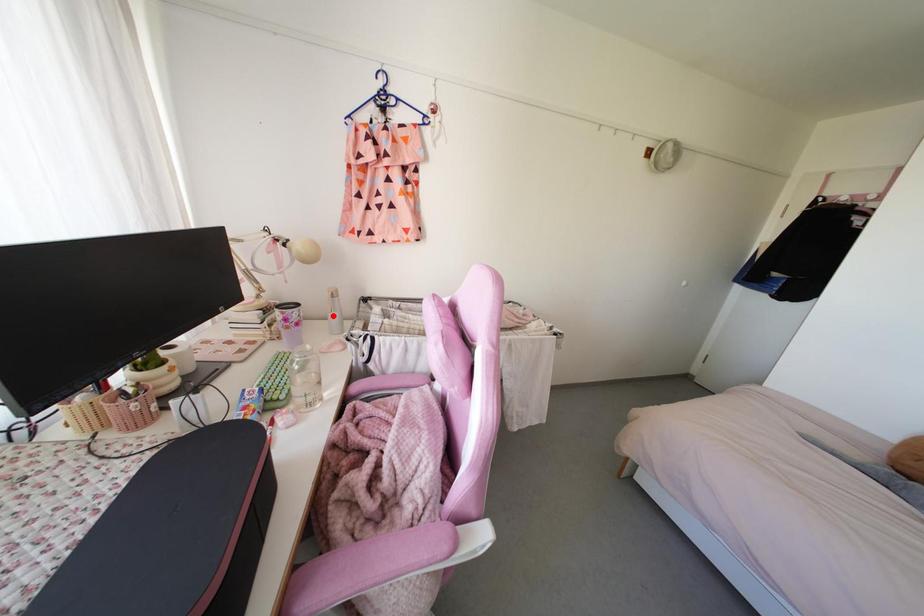
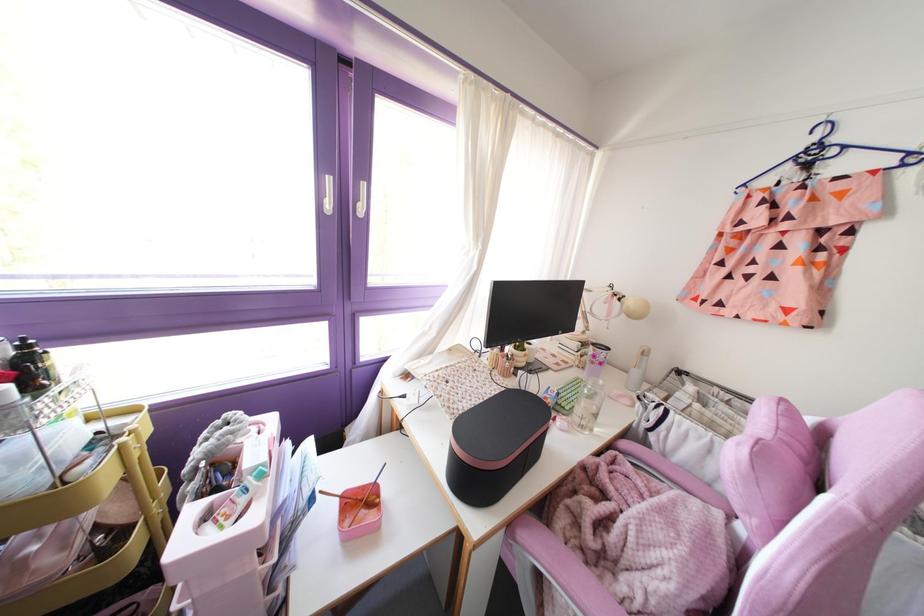
In the second image, find the point that corresponds to the highlighted location in the first image.

(634, 371)